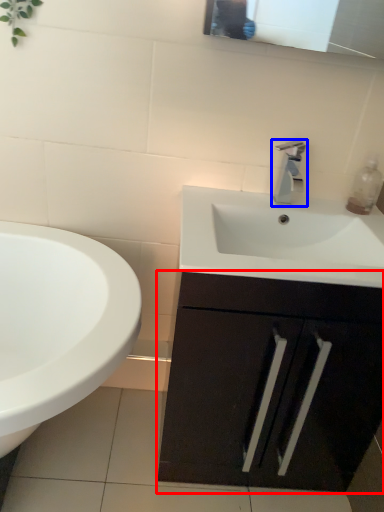
Question: Which object is further to the camera taking this photo, bathroom cabinet (highlighted by a red box) or tap (highlighted by a blue box)?

Choices:
 (A) bathroom cabinet
 (B) tap

Answer: (B)